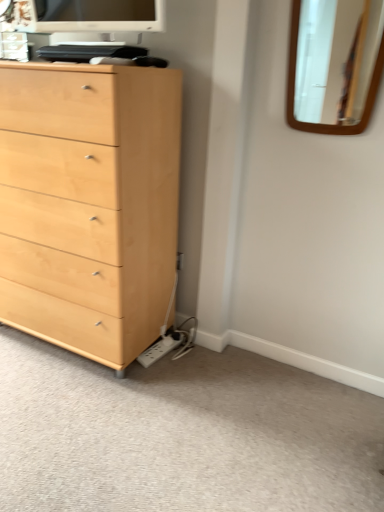
Question: Is light brown wood dresser at lower left turned away from matte white monitor at upper center?

Choices:
 (A) yes
 (B) no

Answer: (B)

Question: Considering the relative sizes of light brown wood dresser at lower left and matte white monitor at upper center in the image provided, is light brown wood dresser at lower left wider than matte white monitor at upper center?

Choices:
 (A) no
 (B) yes

Answer: (B)

Question: From the image's perspective, is light brown wood dresser at lower left under matte white monitor at upper center?

Choices:
 (A) yes
 (B) no

Answer: (A)

Question: Is matte white monitor at upper center surrounded by light brown wood dresser at lower left?

Choices:
 (A) yes
 (B) no

Answer: (B)

Question: From a real-world perspective, does light brown wood dresser at lower left sit lower than matte white monitor at upper center?

Choices:
 (A) yes
 (B) no

Answer: (A)

Question: Considering the relative sizes of light brown wood dresser at lower left and matte white monitor at upper center in the image provided, is light brown wood dresser at lower left taller than matte white monitor at upper center?

Choices:
 (A) yes
 (B) no

Answer: (B)

Question: From the image's perspective, does matte white monitor at upper center appear lower than light brown wood dresser at lower left?

Choices:
 (A) no
 (B) yes

Answer: (A)

Question: Is matte white monitor at upper center positioned far away from light brown wood dresser at lower left?

Choices:
 (A) no
 (B) yes

Answer: (B)

Question: Considering the relative sizes of matte white monitor at upper center and light brown wood dresser at lower left in the image provided, is matte white monitor at upper center wider than light brown wood dresser at lower left?

Choices:
 (A) yes
 (B) no

Answer: (B)

Question: Does matte white monitor at upper center appear on the left side of light brown wood dresser at lower left?

Choices:
 (A) yes
 (B) no

Answer: (A)

Question: From a real-world perspective, is matte white monitor at upper center beneath light brown wood dresser at lower left?

Choices:
 (A) yes
 (B) no

Answer: (B)

Question: From the image's perspective, is matte white monitor at upper center over light brown wood dresser at lower left?

Choices:
 (A) yes
 (B) no

Answer: (A)

Question: Does matte white monitor at upper center have a lesser height compared to light wood chest of drawers at left?

Choices:
 (A) yes
 (B) no

Answer: (A)